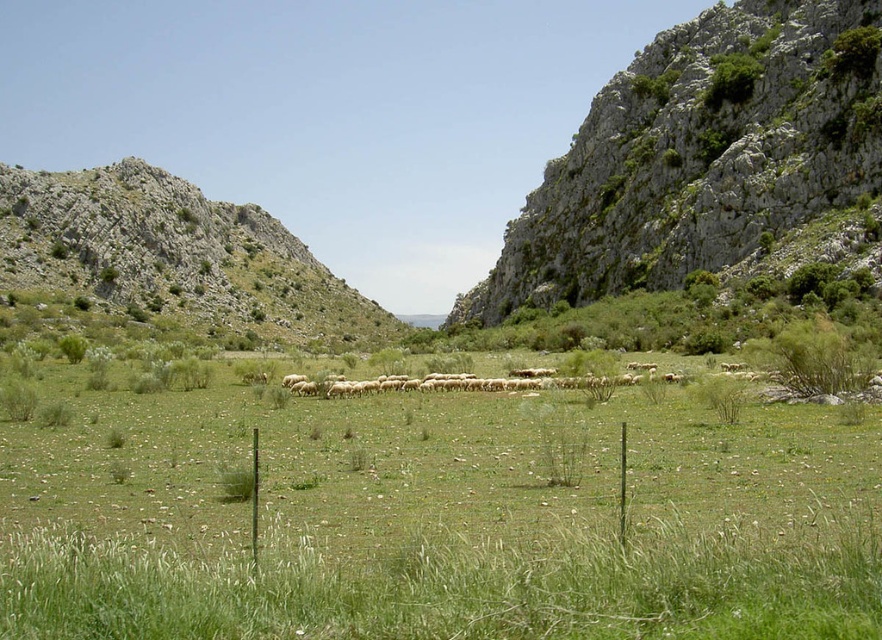
In the scene shown: You are standing in the valley looking at the scene. There is a point marked at coordinates (699, 154). What does this point indicate?

The point at (699, 154) indicates the green rocky hillside at upper right.

You are standing in the valley and want to reach the point marked at coordinates (684, 51). Given that the valley is 150 meters wide, can you safely walk directly to that point without crossing any obstacles?

The point at (684, 51) is 127.67 meters away from you. Since the valley is 150 meters wide, you can safely walk directly to the point without crossing any obstacles as the distance is within the valley width.

You are a hiker planning to cross the valley. You see the green rocky hillside at upper right and the rugged stone hillside at left. Which hillside would require more time to traverse due to its width?

The rugged stone hillside at left requires more time to traverse because it has a greater width than the green rocky hillside at upper right.